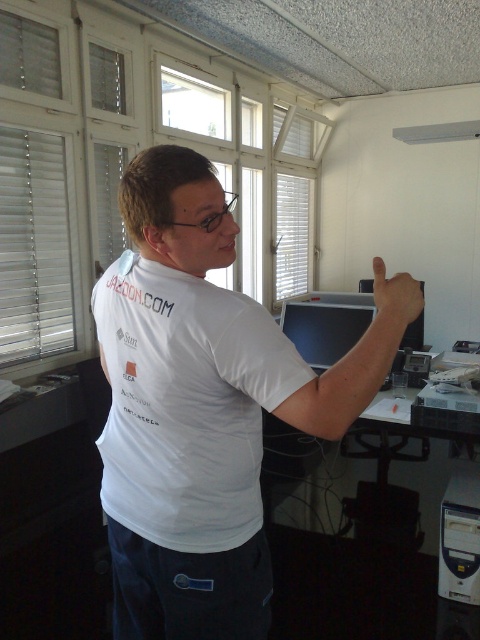
You are a photographer adjusting your camera to capture the scene. You notice two points in the image at coordinates point (148,339) and point (178,376). Which point is closer to the camera lens?

Point (178,376) is closer to the camera lens because it is less further than point (148,339), which is further away.

You are standing in an office and see two points marked in the room. The first point is at coordinates point (177, 413) and the second point is at point (387, 316). Which point is closer to you?

Point (177, 413) is closer to the viewer than point (387, 316).

You are an office worker who wants to show your new shirt to your colleague. You point to the white matte shirt at center and the matte white hand at upper right in the image. Which object is located to the left of the other?

The white matte shirt at center is positioned on the left side of matte white hand at upper right.